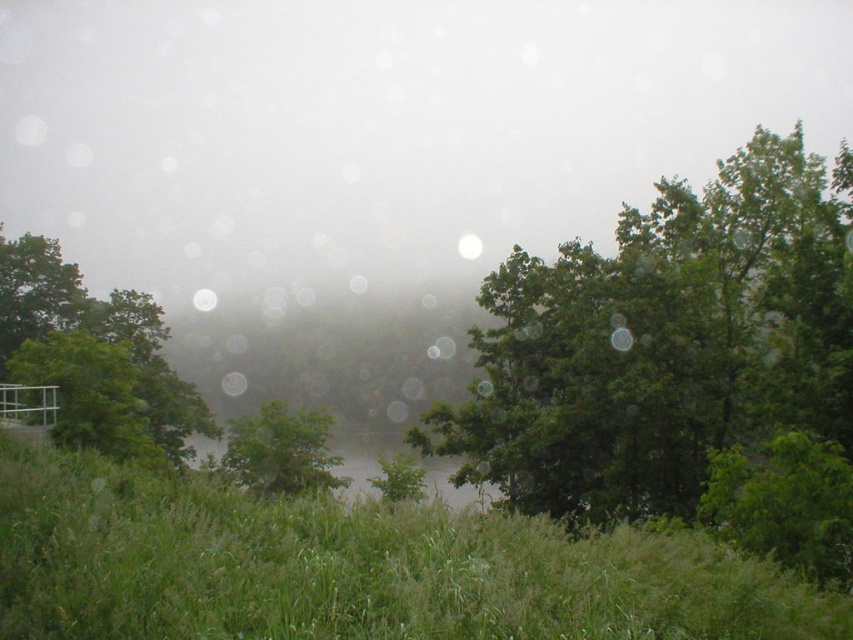
You are standing in the middle of the field looking towards the lake. Which object is closer to you, the green leafy tree at center or the green grassy lake at center?

The green leafy tree at center is closer to you because it is positioned to the left of the green grassy lake at center, which is further away.

You are standing in the serene landscape and want to move from the point closer to you to the farther point. Which path would you take between the two points, point (781, 260) and point (111, 340)?

You should take the path from point (781, 260) to point (111, 340) since point (781, 260) is closer to the viewer and you need to move towards the farther point.

You are a hiker standing in the green grassy field at lower center. Looking towards the green leafy tree at upper right, how does its height compare to the grasses around you?

The green leafy tree at upper right is much taller than the green grassy field at lower center, so the tree towers over the grasses around you.